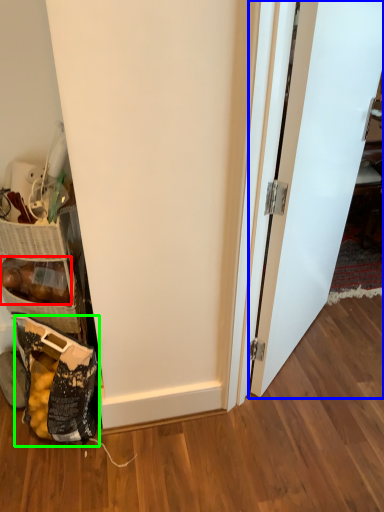
Question: Considering the real-world distances, which object is closest to stuff (highlighted by a red box)? door (highlighted by a blue box) or material (highlighted by a green box).

Choices:
 (A) door
 (B) material

Answer: (B)